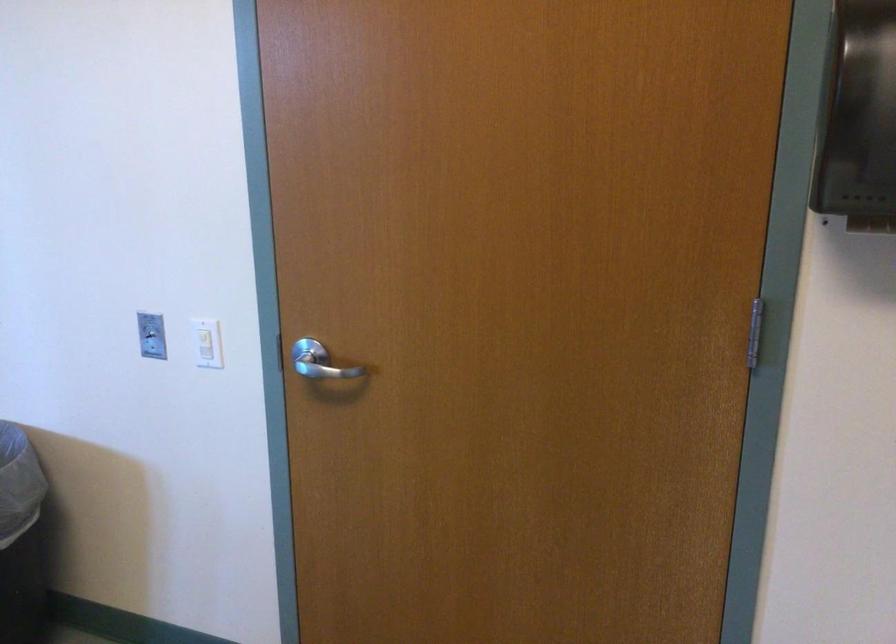
What do you see at coordinates (205, 346) in the screenshot? I see `the white light switch` at bounding box center [205, 346].